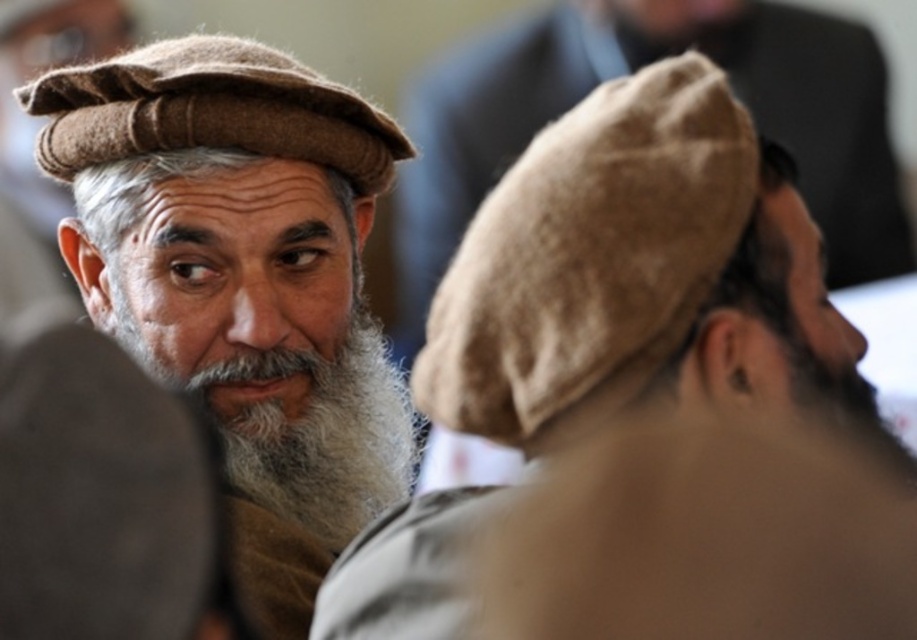
Question: Can you confirm if matte brown cap at center is smaller than brown felt hat at upper center?

Choices:
 (A) yes
 (B) no

Answer: (B)

Question: Is matte brown cap at center positioned before beige woolen cap at upper left?

Choices:
 (A) no
 (B) yes

Answer: (A)

Question: Which object is farther from the camera taking this photo?

Choices:
 (A) beige woolen cap at upper left
 (B) brown felt hat at upper center
 (C) matte brown cap at center

Answer: (C)

Question: Which of the following is the farthest from the observer?

Choices:
 (A) graywoollybeard at center-left
 (B) brown felt hat at upper center
 (C) matte brown cap at center
 (D) brown woolen cap at upper left

Answer: (A)

Question: Is matte brown cap at center positioned behind beige woolen cap at upper left?

Choices:
 (A) no
 (B) yes

Answer: (B)

Question: Among these objects, which one is farthest from the camera?

Choices:
 (A) brown woolen cap at upper left
 (B) brown felt hat at upper center

Answer: (A)